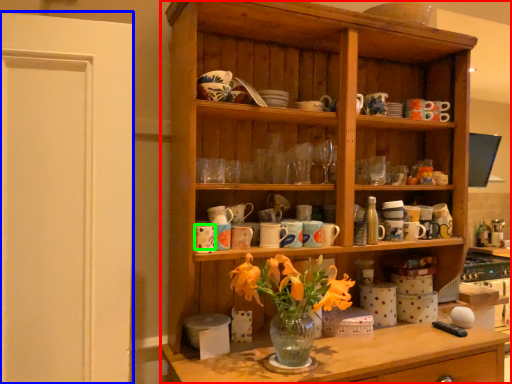
Question: Based on their relative distances, which object is nearer to cabinetry (highlighted by a red box)? Choose from glass door (highlighted by a blue box) and tableware (highlighted by a green box).

Choices:
 (A) glass door
 (B) tableware

Answer: (A)